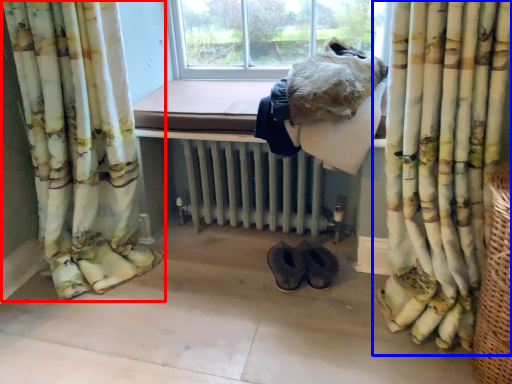
Question: Among these objects, which one is nearest to the camera, curtain (highlighted by a red box) or curtain (highlighted by a blue box)?

Choices:
 (A) curtain
 (B) curtain

Answer: (B)